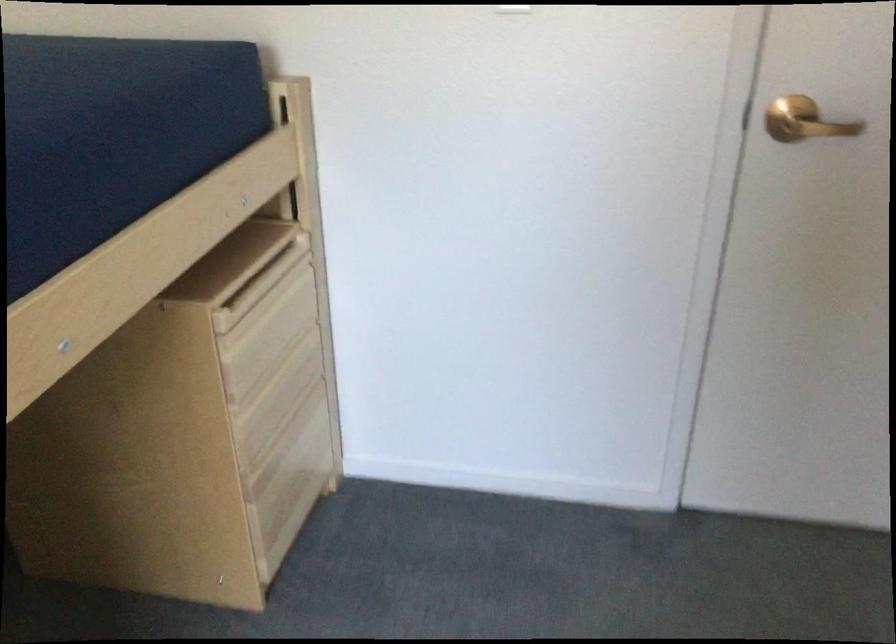
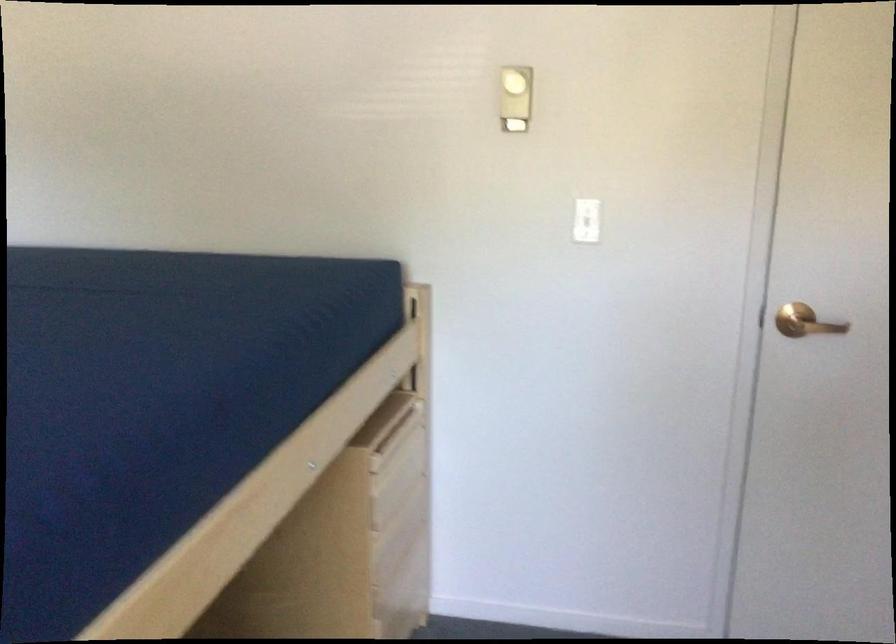
Locate, in the second image, the point that corresponds to point 800,118 in the first image.

(805, 322)